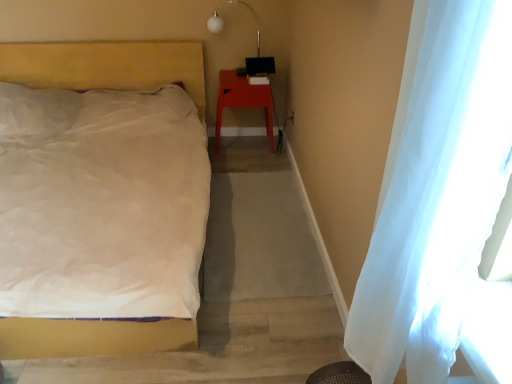
The width and height of the screenshot is (512, 384). Find the location of `white glass lamp at upper center`. white glass lamp at upper center is located at coordinates (223, 22).

Measure the distance between white matte bed at left and camera.

white matte bed at left and camera are 9.99 feet apart from each other.

Locate an element on the screen. This screenshot has height=384, width=512. white glass lamp at upper center is located at coordinates (223, 22).

Is matte plastic stool at right turned away from white sheer curtain at right?

No, matte plastic stool at right is not facing the opposite direction of white sheer curtain at right.

Is point (250, 94) behind point (372, 283)?

Yes.

Which object is further away from the camera, matte plastic stool at right or white sheer curtain at right?

matte plastic stool at right is more distant.

Considering the sizes of objects matte plastic stool at right and white sheer curtain at right in the image provided, who is smaller, matte plastic stool at right or white sheer curtain at right?

white sheer curtain at right.

Looking at this image, which is less distant, (41,86) or (461,274)?

Point (41,86) appears to be farther away from the viewer than point (461,274).

Considering the relative positions of white matte bed at left and white sheer curtain at right in the image provided, is white matte bed at left to the left of white sheer curtain at right from the viewer's perspective?

Correct, you'll find white matte bed at left to the left of white sheer curtain at right.

Between white matte bed at left and white sheer curtain at right, which one has smaller size?

white sheer curtain at right.

Are white matte bed at left and white sheer curtain at right far apart?

Yes.

Who is bigger, white glass lamp at upper center or white sheer curtain at right?

white sheer curtain at right.

Does point (218, 19) appear closer or farther from the camera than point (487, 10)?

Point (218, 19).

Is white sheer curtain at right inside white glass lamp at upper center?

No.

From the image's perspective, is white glass lamp at upper center over white sheer curtain at right?

Correct, white glass lamp at upper center appears higher than white sheer curtain at right in the image.

From the image's perspective, between white sheer curtain at right and white matte bed at left, who is located below?

white sheer curtain at right appears lower in the image.

Is white sheer curtain at right facing towards white matte bed at left?

No, white sheer curtain at right is not oriented towards white matte bed at left.

Would you consider white sheer curtain at right to be distant from white matte bed at left?

white sheer curtain at right is far away from white matte bed at left.

Looking at their sizes, would you say white sheer curtain at right is wider or thinner than white matte bed at left?

white sheer curtain at right is thinner than white matte bed at left.

Is white sheer curtain at right bigger or smaller than matte plastic stool at right?

white sheer curtain at right is smaller than matte plastic stool at right.

In the scene shown: From a real-world perspective, does white sheer curtain at right sit lower than matte plastic stool at right?

No, from a real-world perspective, white sheer curtain at right is not beneath matte plastic stool at right.

Is white sheer curtain at right taller than matte plastic stool at right?

Yes.

Is white sheer curtain at right completely or partially outside of matte plastic stool at right?

Yes, white sheer curtain at right is not within matte plastic stool at right.

Is white glass lamp at upper center at the back of white matte bed at left?

white matte bed at left does not have its back to white glass lamp at upper center.

Between white matte bed at left and white glass lamp at upper center, which one has larger size?

Bigger between the two is white matte bed at left.

Consider the image. Is white glass lamp at upper center inside white matte bed at left?

Actually, white glass lamp at upper center is outside white matte bed at left.

Which of these two, white matte bed at left or white glass lamp at upper center, is thinner?

Thinner between the two is white glass lamp at upper center.

Looking at the image, does matte plastic stool at right seem bigger or smaller compared to white matte bed at left?

matte plastic stool at right is smaller than white matte bed at left.

Is matte plastic stool at right taller than white matte bed at left?

Incorrect, the height of matte plastic stool at right is not larger of that of white matte bed at left.

Is white matte bed at left surrounded by matte plastic stool at right?

No.

Which is more to the left, matte plastic stool at right or white matte bed at left?

From the viewer's perspective, white matte bed at left appears more on the left side.

Locate an element on the screen. The height and width of the screenshot is (384, 512). curtain below the matte plastic stool at right (from the image's perspective) is located at coordinates (438, 196).

You are a GUI agent. You are given a task and a screenshot of the screen. Output one action in this format:
    pyautogui.click(x=<x>, y=<y>)
    Task: Click on the bed below the white sheer curtain at right (from a real-world perspective)
    Image resolution: width=512 pixels, height=384 pixels.
    Given the screenshot: What is the action you would take?
    106,66

Considering their positions, is white sheer curtain at right positioned closer to white matte bed at left than matte plastic stool at right?

matte plastic stool at right.

Estimate the real-world distances between objects in this image. Which object is closer to white glass lamp at upper center, matte plastic stool at right or white sheer curtain at right?

matte plastic stool at right is positioned closer to the anchor white glass lamp at upper center.

Estimate the real-world distances between objects in this image. Which object is further from white glass lamp at upper center, white matte bed at left or white sheer curtain at right?

white sheer curtain at right is positioned further to the anchor white glass lamp at upper center.

From the image, which object appears to be nearer to matte plastic stool at right, white glass lamp at upper center or white sheer curtain at right?

white glass lamp at upper center is closer to matte plastic stool at right.

Which object lies nearer to the anchor point matte plastic stool at right, white glass lamp at upper center or white matte bed at left?

white glass lamp at upper center is positioned closer to the anchor matte plastic stool at right.

Estimate the real-world distances between objects in this image. Which object is further from white matte bed at left, matte plastic stool at right or white glass lamp at upper center?

matte plastic stool at right lies further to white matte bed at left than the other object.

From the image, which object appears to be farther from white glass lamp at upper center, white matte bed at left or matte plastic stool at right?

Among the two, white matte bed at left is located further to white glass lamp at upper center.

Looking at the image, which one is located closer to white sheer curtain at right, matte plastic stool at right or white matte bed at left?

Based on the image, matte plastic stool at right appears to be nearer to white sheer curtain at right.

The width and height of the screenshot is (512, 384). I want to click on bed positioned between white sheer curtain at right and white glass lamp at upper center from near to far, so click(x=106, y=66).

Where is `lamp between white sheer curtain at right and matte plastic stool at right along the z-axis`? The height and width of the screenshot is (384, 512). lamp between white sheer curtain at right and matte plastic stool at right along the z-axis is located at coordinates (223, 22).

Where is `lamp between white matte bed at left and matte plastic stool at right from front to back`? lamp between white matte bed at left and matte plastic stool at right from front to back is located at coordinates (223, 22).

At what (x,y) coordinates should I click in order to perform the action: click on bed positioned between white sheer curtain at right and matte plastic stool at right from near to far. Please return your answer as a coordinate pair (x, y). The width and height of the screenshot is (512, 384). Looking at the image, I should click on (106, 66).